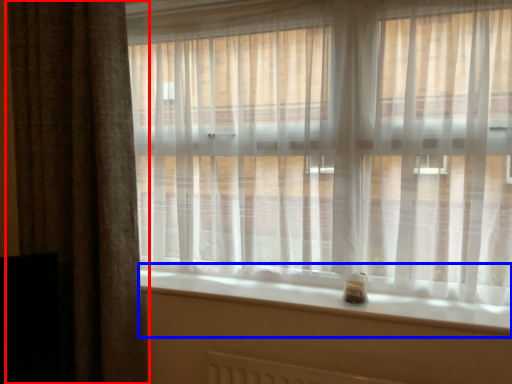
Question: Which point is closer to the camera, curtain (highlighted by a red box) or window sill (highlighted by a blue box)?

Choices:
 (A) curtain
 (B) window sill

Answer: (B)